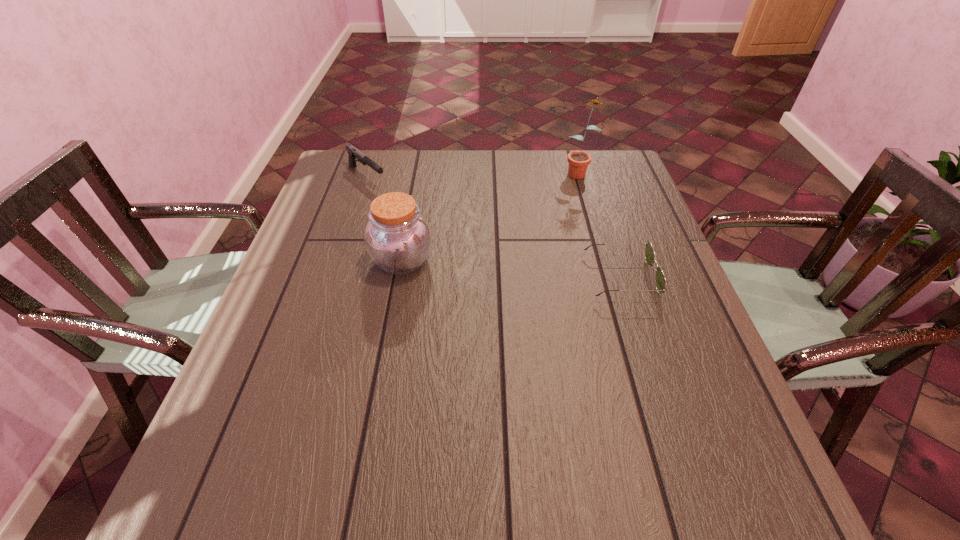
The width and height of the screenshot is (960, 540). In order to click on vacant space on the desktop that is between the jar and the sunglasses and is positioned on the flower of the tallest object in this screenshot , I will do `click(495, 267)`.

Where is `free spot on the desktop that is between the third object from right to left and the shortest object and is positioned at the muzzle end of the gun`? free spot on the desktop that is between the third object from right to left and the shortest object and is positioned at the muzzle end of the gun is located at coordinates (482, 267).